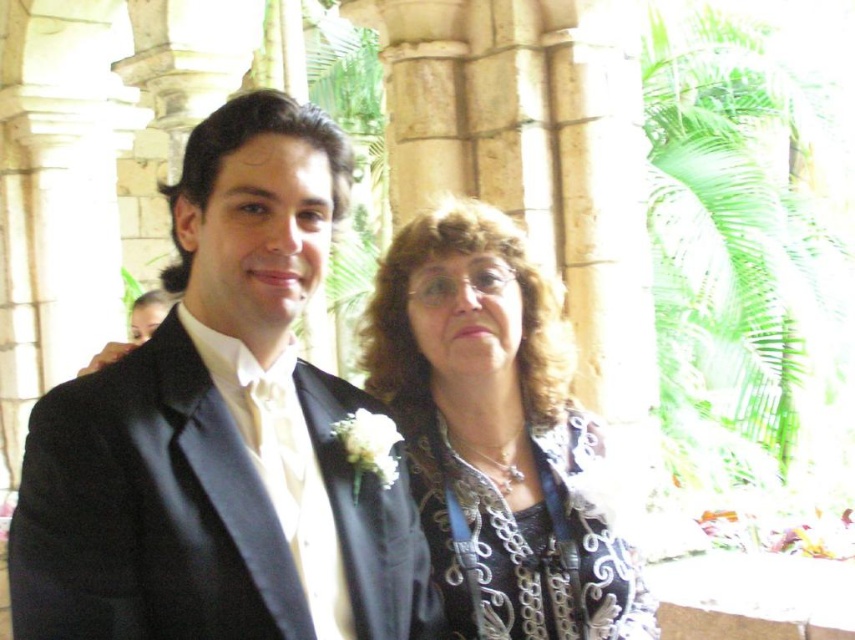
From the picture: Which is more to the left, satin black suit at center or silver embroidered jacket at center?

satin black suit at center

Between satin black suit at center and silver embroidered jacket at center, which one has more height?

satin black suit at center

This screenshot has width=855, height=640. In order to click on satin black suit at center in this screenshot , I will do `click(223, 433)`.

Is silver embroidered jacket at center further to the viewer compared to silver metallic dress at center?

That is False.

Which is above, silver embroidered jacket at center or silver metallic dress at center?

silver embroidered jacket at center is higher up.

This screenshot has width=855, height=640. What do you see at coordinates (496, 433) in the screenshot?
I see `silver embroidered jacket at center` at bounding box center [496, 433].

The height and width of the screenshot is (640, 855). In order to click on silver embroidered jacket at center in this screenshot , I will do `click(496, 433)`.

In the scene shown: Does satin black suit at center have a greater width compared to silver metallic dress at center?

Yes.

Is satin black suit at center in front of silver metallic dress at center?

Yes.

Which is behind, point (199, 506) or point (461, 573)?

The point (461, 573) is behind.

Find the location of a particular element. Image resolution: width=855 pixels, height=640 pixels. satin black suit at center is located at coordinates (223, 433).